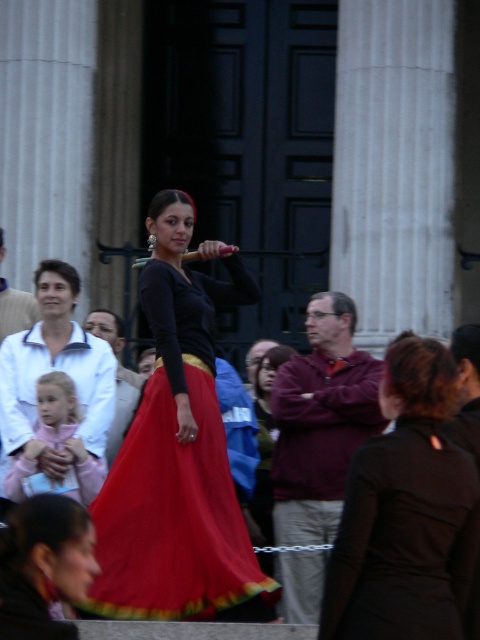
You are standing at the center of the street scene and notice a point marked at coordinates (44, 564). Which object in the scene does this point correspond to?

The point at coordinates (44, 564) is on the silky red skirt at center.

You are a photographer at the event and need to capture both the matte white jacket at left and the silky red skirt at center in a single shot. Given that your camera has a fixed focal length and limited depth of field, which object should you focus on to ensure the other remains in acceptable focus?

The matte white jacket at left is smaller than the silky red skirt at center. To ensure both are in acceptable focus, you should focus on the silky red skirt at center since it is larger and closer to the camera, allowing the smaller matte white jacket at left to stay within the depth of field range.

You are a photographer at the event and want to capture the woman wearing the maroon fleece jacket at center and silky red skirt at center. Which clothing item is visible on top?

The maroon fleece jacket at center is positioned over the silky red skirt at center, so the maroon fleece jacket at center is visible on top.